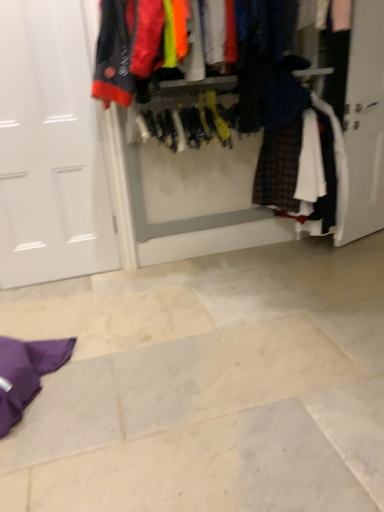
Describe the element at coordinates (50, 149) in the screenshot. This screenshot has height=512, width=384. I see `white matte door at left` at that location.

This screenshot has width=384, height=512. I want to click on white matte door at left, so click(50, 149).

The height and width of the screenshot is (512, 384). What do you see at coordinates (275, 178) in the screenshot?
I see `textured fabric closet at center` at bounding box center [275, 178].

Find the location of a particular element. textured fabric closet at center is located at coordinates (275, 178).

Image resolution: width=384 pixels, height=512 pixels. I want to click on white matte door at left, so click(50, 149).

Which object is positioned more to the right, white matte door at left or textured fabric closet at center?

textured fabric closet at center is more to the right.

Is the depth of white matte door at left less than that of textured fabric closet at center?

No, white matte door at left is further to the viewer.

Is point (4, 5) positioned after point (186, 81)?

No, it is not.

From the image's perspective, which one is positioned lower, white matte door at left or textured fabric closet at center?

From the image's view, white matte door at left is below.

From a real-world perspective, is white matte door at left physically located above or below textured fabric closet at center?

white matte door at left is below textured fabric closet at center.

In the scene shown: Is white matte door at left wider or thinner than textured fabric closet at center?

white matte door at left is thinner than textured fabric closet at center.

Which of these two, white matte door at left or textured fabric closet at center, stands shorter?

textured fabric closet at center is shorter.

Is white matte door at left bigger or smaller than textured fabric closet at center?

Considering their sizes, white matte door at left takes up less space than textured fabric closet at center.

From the picture: Would you say white matte door at left is inside or outside textured fabric closet at center?

white matte door at left is spatially situated outside textured fabric closet at center.

Can you see white matte door at left touching textured fabric closet at center?

There is a gap between white matte door at left and textured fabric closet at center.

Is white matte door at left facing towards textured fabric closet at center?

No, white matte door at left does not turn towards textured fabric closet at center.

How many degrees apart are the facing directions of white matte door at left and textured fabric closet at center?

There is a 0.81-degree angle between the facing directions of white matte door at left and textured fabric closet at center.

Identify the location of closet lying in front of the white matte door at left. Image resolution: width=384 pixels, height=512 pixels. (275, 178).

Based on their positions, is textured fabric closet at center located to the left or right of white matte door at left?

textured fabric closet at center is to the right of white matte door at left.

Which object is closer to the camera taking this photo, textured fabric closet at center or white matte door at left?

textured fabric closet at center is closer to the camera.

Is point (144, 19) more distant than point (76, 176)?

That is False.

From the image's perspective, between textured fabric closet at center and white matte door at left, which one is located above?

From the image's view, textured fabric closet at center is above.

From a real-world perspective, is textured fabric closet at center above or below white matte door at left?

In terms of real-world spatial position, textured fabric closet at center is above white matte door at left.

Considering the relative sizes of textured fabric closet at center and white matte door at left in the image provided, is textured fabric closet at center thinner than white matte door at left?

No.

Between textured fabric closet at center and white matte door at left, which one has less height?

With less height is textured fabric closet at center.

From the picture: Is textured fabric closet at center bigger than white matte door at left?

Yes.

From the picture: Can we say textured fabric closet at center lies outside white matte door at left?

Absolutely, textured fabric closet at center is external to white matte door at left.

Looking at this image, is textured fabric closet at center not close to white matte door at left?

textured fabric closet at center is near white matte door at left, not far away.

Is textured fabric closet at center turned away from white matte door at left?

No.

Identify the location of closet that appears on the right of white matte door at left. (275, 178).

In the image, there is a white matte door at left. Find the location of `closet above it (from the image's perspective)`. closet above it (from the image's perspective) is located at coordinates (275, 178).

Where is `door that appears behind the textured fabric closet at center`? door that appears behind the textured fabric closet at center is located at coordinates (50, 149).